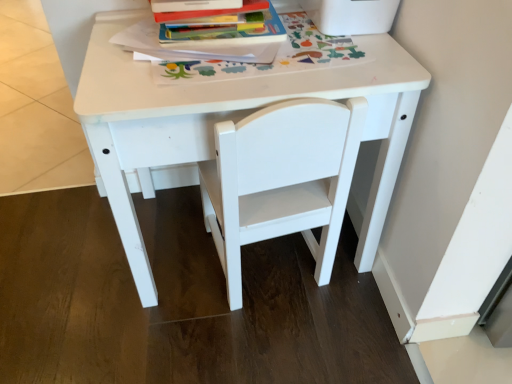
This screenshot has width=512, height=384. I want to click on free point above white matte table at center (from a real-world perspective), so click(x=236, y=47).